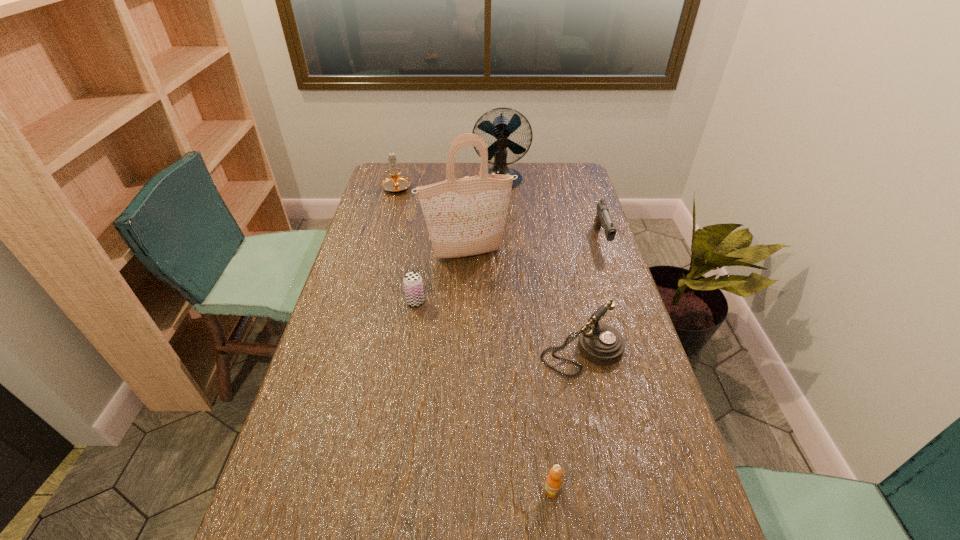
This screenshot has height=540, width=960. What are the coordinates of `vacant space located on the right of the leftmost object` in the screenshot? It's located at (465, 186).

Locate an element on the screen. Image resolution: width=960 pixels, height=540 pixels. free location located in the direction the rightmost object is aimed is located at coordinates (615, 281).

This screenshot has width=960, height=540. Find the location of `vacant area located on the left of the telephone`. vacant area located on the left of the telephone is located at coordinates (514, 352).

Where is `free space located 0.250m on the back of the fifth farthest object`? free space located 0.250m on the back of the fifth farthest object is located at coordinates (424, 246).

You are a GUI agent. You are given a task and a screenshot of the screen. Output one action in this format:
    pyautogui.click(x=<x>, y=<y>)
    Task: Click on the fan that is at the far edge
    
    Given the screenshot: What is the action you would take?
    pyautogui.click(x=501, y=128)

Locate an element on the screen. The height and width of the screenshot is (540, 960). candle located at the far edge is located at coordinates (395, 183).

Identify the location of object at the left edge. This screenshot has height=540, width=960. (395, 183).

Find the location of a particular element. The image size is (960, 540). gun located in the right edge section of the desktop is located at coordinates (603, 218).

The width and height of the screenshot is (960, 540). What are the coordinates of `telephone at the right edge` in the screenshot? It's located at (601, 344).

Where is `object at the far left corner`? Image resolution: width=960 pixels, height=540 pixels. object at the far left corner is located at coordinates (395, 183).